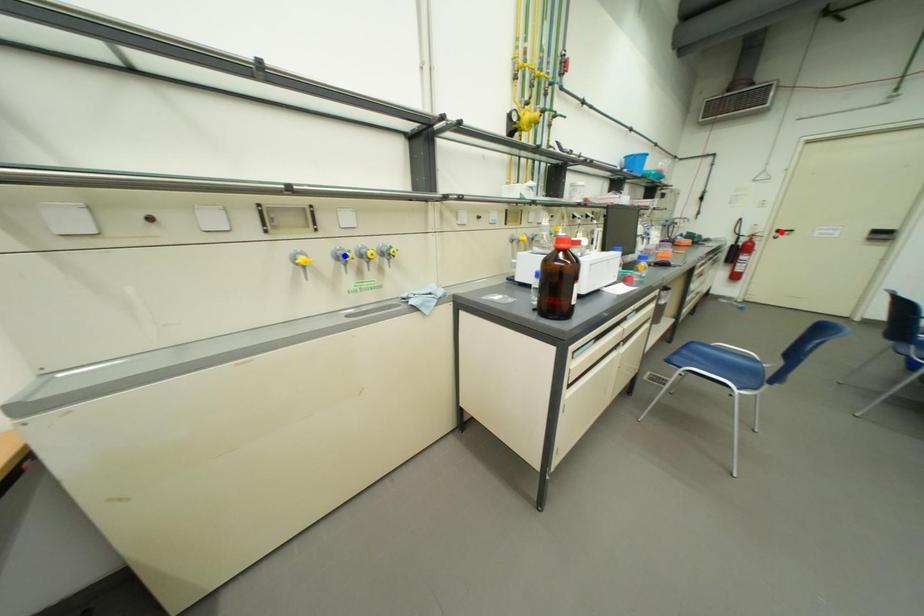
Order these from nearest to farthest:
1. red point
2. blue point
3. orange point

1. blue point
2. orange point
3. red point